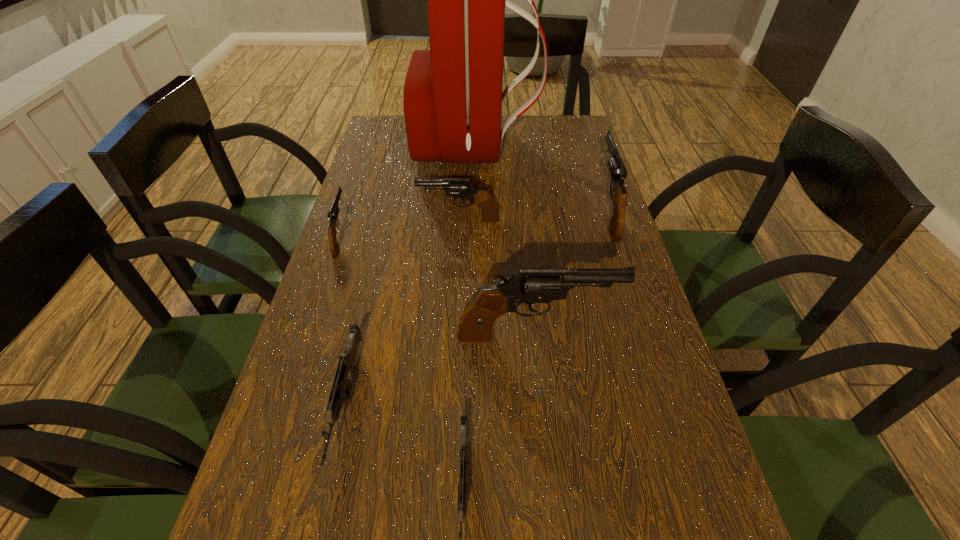
Identify the location of the tallest object. (452, 99).

At what (x,y) coordinates should I click in order to perform the action: click on backpack. Please return your answer as a coordinate pair (x, y). The width and height of the screenshot is (960, 540). Looking at the image, I should click on (452, 99).

The width and height of the screenshot is (960, 540). I want to click on the nearest black gun, so click(530, 285).

You are a GUI agent. You are given a task and a screenshot of the screen. Output one action in this format:
    pyautogui.click(x=<x>, y=<y>)
    Task: Click on the second tallest object
    The image size is (960, 540).
    Given the screenshot: What is the action you would take?
    pyautogui.click(x=530, y=285)

Where is `the rightmost black gun`? the rightmost black gun is located at coordinates (618, 171).

Where is `the rightmost gun`? the rightmost gun is located at coordinates click(x=618, y=171).

Find the location of a particular element. This screenshot has height=540, width=960. the fourth shortest object is located at coordinates (462, 188).

Find the location of a particular element. The height and width of the screenshot is (540, 960). the second smallest black gun is located at coordinates (462, 188).

At what (x,y) coordinates should I click in order to perform the action: click on the third shortest object. Please return your answer as a coordinate pair (x, y). The width and height of the screenshot is (960, 540). Looking at the image, I should click on (334, 210).

Locate an element on the screen. Image resolution: width=960 pixels, height=540 pixels. the leftmost object is located at coordinates (334, 210).